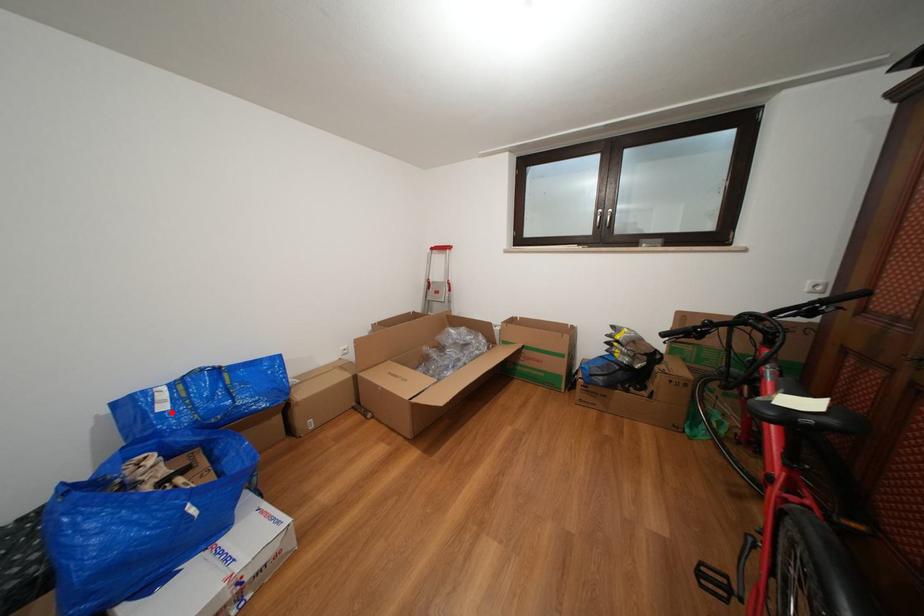
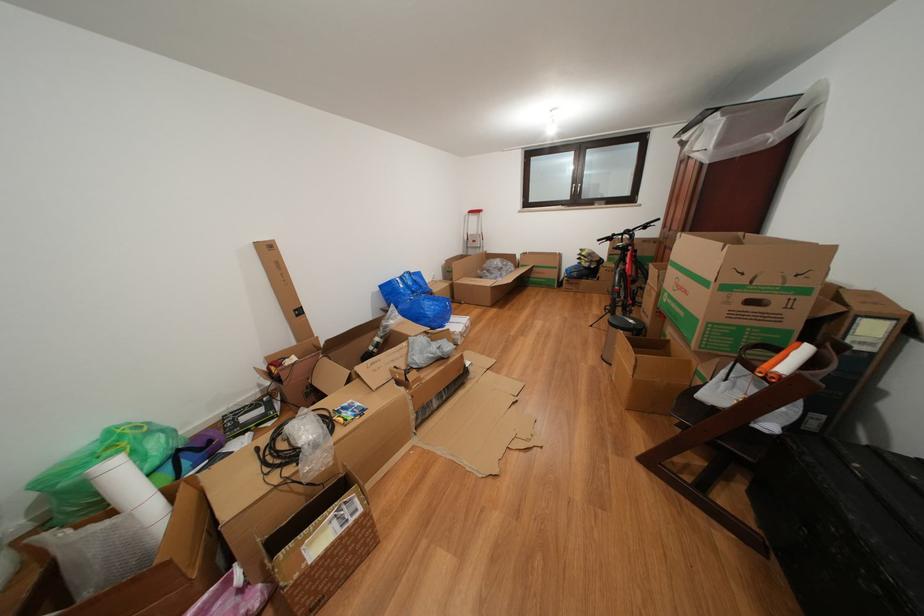
Locate, in the second image, the point that corresponds to the highlighted location in the first image.

(409, 291)